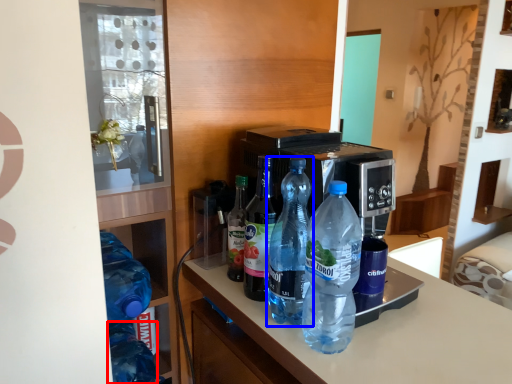
Question: Which object is closer to the camera taking this photo, bottle (highlighted by a red box) or bottle (highlighted by a blue box)?

Choices:
 (A) bottle
 (B) bottle

Answer: (B)